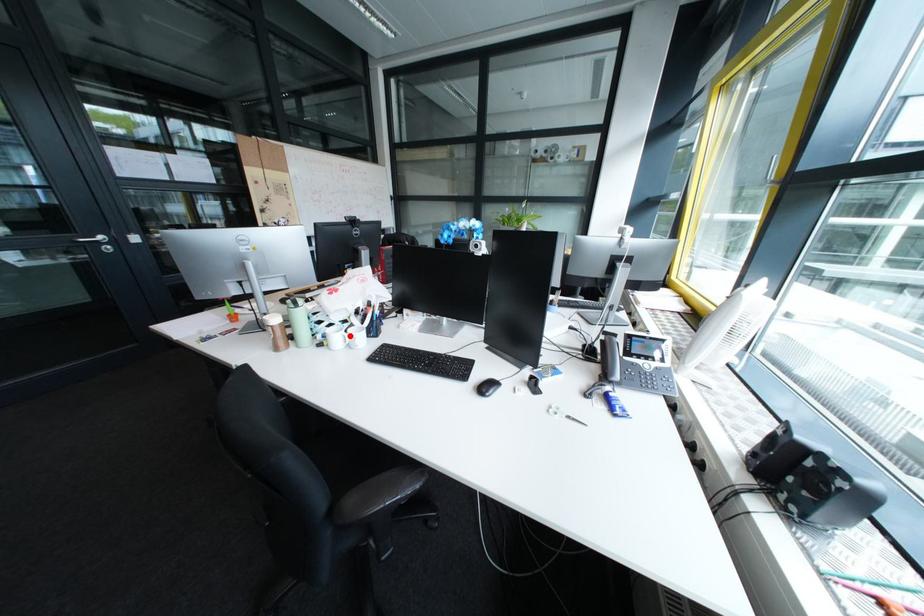
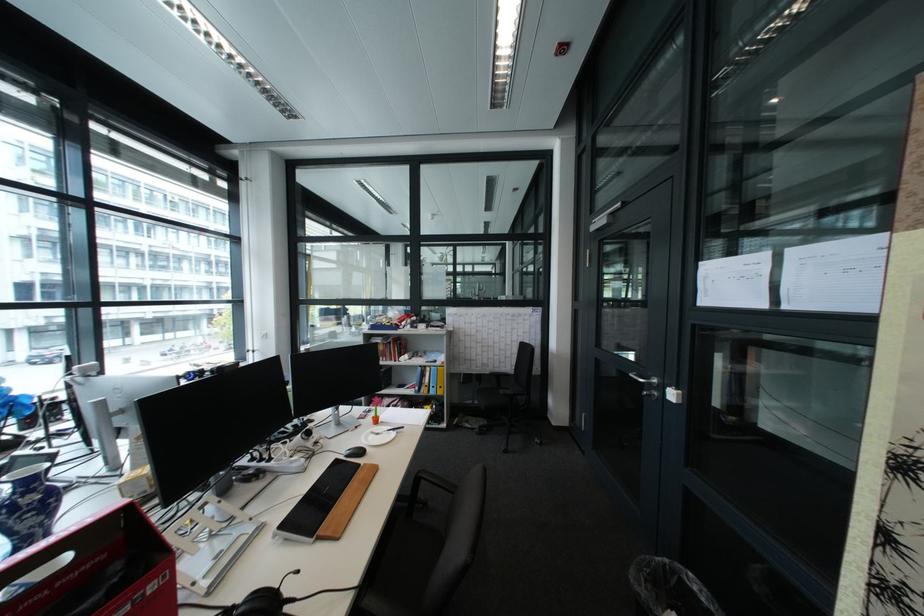
Question: I am providing you with two images of the same scene from different viewpoints. A red point is marked on the first image. Is the red point's position out of view in image 2?

Choices:
 (A) Yes
 (B) No

Answer: (A)